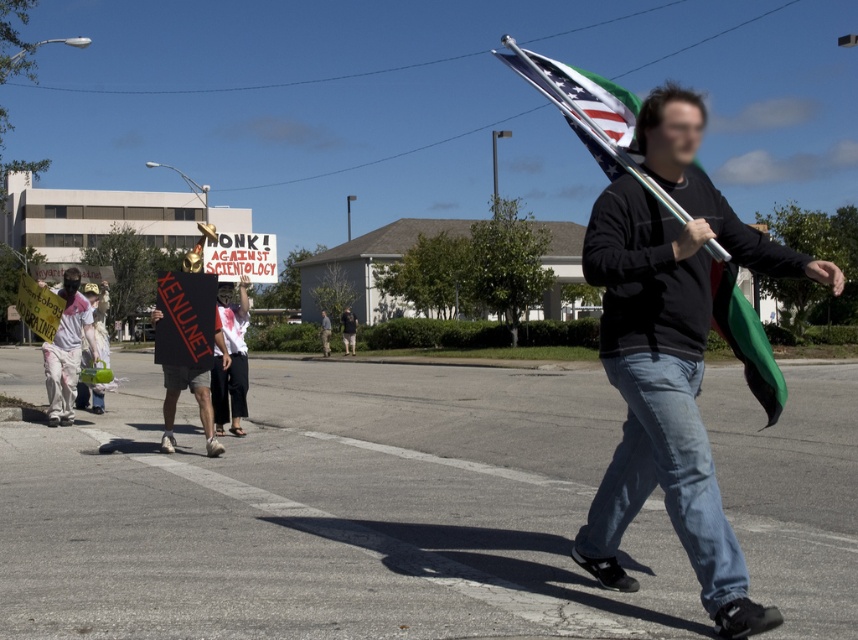
Question: Can you confirm if matte black shirt at center is wider than american flag at center?

Choices:
 (A) no
 (B) yes

Answer: (A)

Question: Does matte black shirt at center lie behind white paper sign at center?

Choices:
 (A) no
 (B) yes

Answer: (A)

Question: Which point is farther to the camera?

Choices:
 (A) (597, 218)
 (B) (762, 376)

Answer: (B)

Question: Does matte black shirt at center have a lesser width compared to white paper sign at center?

Choices:
 (A) yes
 (B) no

Answer: (A)

Question: Which point is closer to the camera?

Choices:
 (A) [657, 196]
 (B) [41, 352]
 (C) [811, 259]

Answer: (A)

Question: Which of the following is the closest to the observer?

Choices:
 (A) (590, 92)
 (B) (74, 385)

Answer: (A)